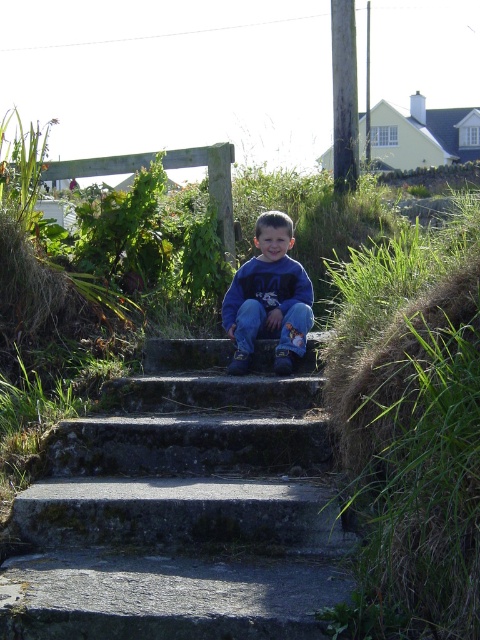
You are a photographer trying to capture the entire scene of the concrete stairs at center and the blue cotton sweatshirt at center in one shot. Given that your camera can only focus on objects larger than 1 meter in size, will both objects be in focus?

The concrete stairs at center is larger in size than the blue cotton sweatshirt at center. Since the camera can only focus on objects larger than 1 meter, the concrete stairs at center will be in focus, but the blue cotton sweatshirt at center may not be if it is smaller than 1 meter.

You are a parent trying to help your child climb up the concrete stairs at center while wearing a blue cotton sweatshirt at center. Will the sweatshirt interfere with their ability to climb the stairs?

The concrete stairs at center has a lesser height compared to blue cotton sweatshirt at center. This means the stairs are shorter than the sweatshirt, so the sweatshirt might drag or get caught on the stairs when climbing, potentially causing difficulty.

You are standing at the point labeled as point (285, 324) and want to walk to the point labeled as point (149, 506). According to the scene, which direction should you move to reach your destination?

You should move forward because point (149, 506) is in front of point (285, 324).